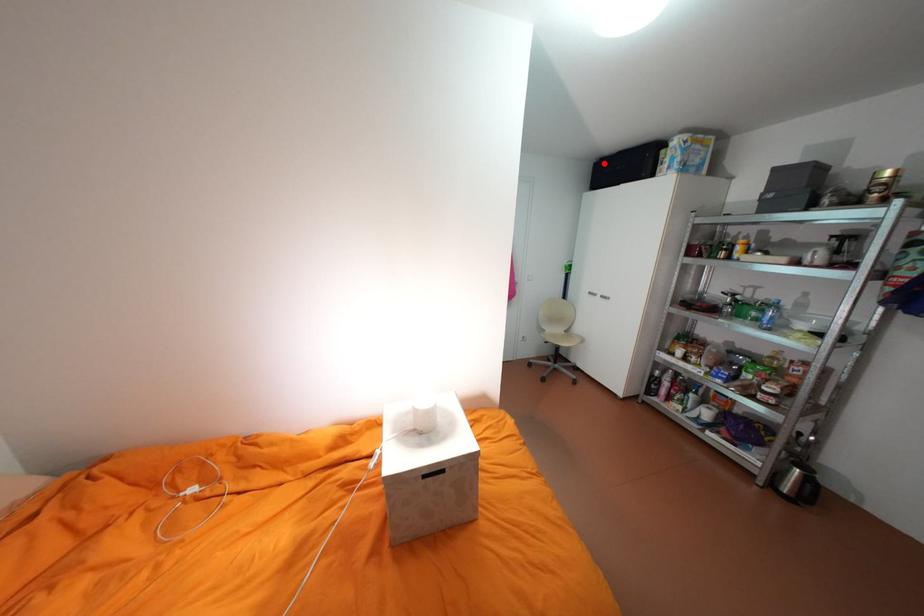
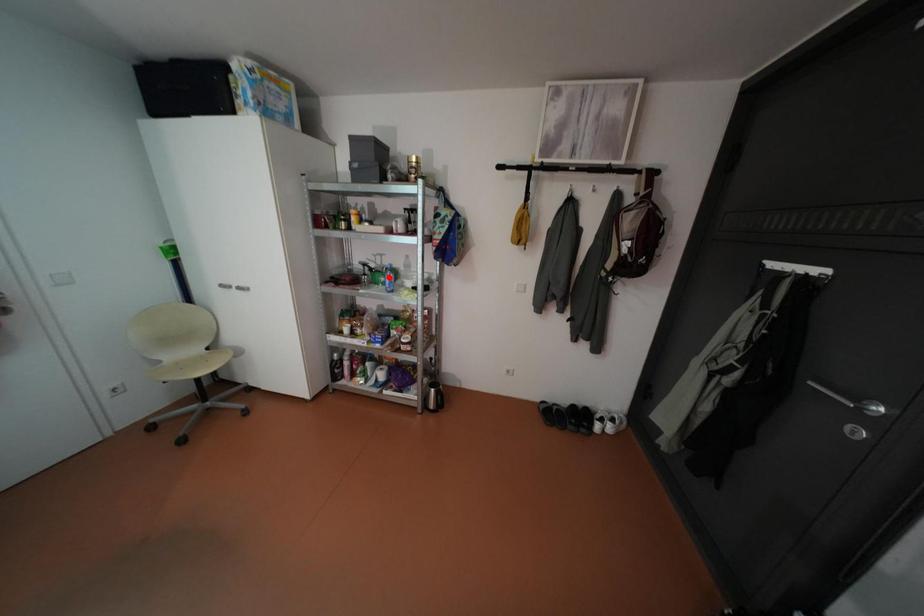
In the scene shown: I am providing you with two images of the same scene from different viewpoints. A red point is marked on the first image and another point is marked on the second image. Is the marked point in image1 the same physical position as the marked point in image2?

No